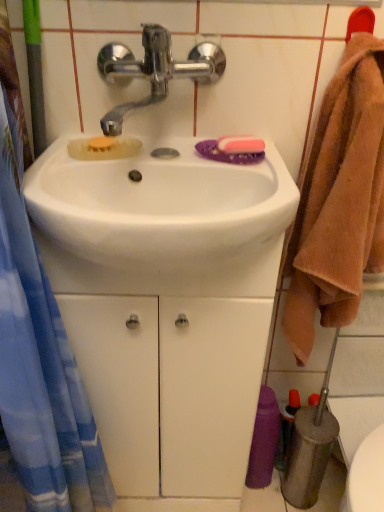
Question: Considering the relative positions of shiny metallic faucet at upper center and purple fabric towel at lower right in the image provided, is shiny metallic faucet at upper center to the left of purple fabric towel at lower right from the viewer's perspective?

Choices:
 (A) no
 (B) yes

Answer: (B)

Question: Considering the relative positions of shiny metallic faucet at upper center and purple fabric towel at lower right in the image provided, is shiny metallic faucet at upper center to the right of purple fabric towel at lower right from the viewer's perspective?

Choices:
 (A) yes
 (B) no

Answer: (B)

Question: From the image's perspective, is shiny metallic faucet at upper center located beneath purple fabric towel at lower right?

Choices:
 (A) yes
 (B) no

Answer: (B)

Question: Is shiny metallic faucet at upper center touching purple fabric towel at lower right?

Choices:
 (A) yes
 (B) no

Answer: (B)

Question: Would you say shiny metallic faucet at upper center contains purple fabric towel at lower right?

Choices:
 (A) no
 (B) yes

Answer: (A)

Question: Is shiny metallic faucet at upper center located outside purple fabric towel at lower right?

Choices:
 (A) no
 (B) yes

Answer: (B)

Question: Is white glossy sink at center thinner than brown fluffy towel at right?

Choices:
 (A) yes
 (B) no

Answer: (B)

Question: Does white glossy sink at center turn towards brown fluffy towel at right?

Choices:
 (A) yes
 (B) no

Answer: (B)

Question: Is white glossy sink at center far from brown fluffy towel at right?

Choices:
 (A) no
 (B) yes

Answer: (A)

Question: Is white glossy sink at center to the left of brown fluffy towel at right from the viewer's perspective?

Choices:
 (A) no
 (B) yes

Answer: (B)

Question: Considering the relative positions of white glossy sink at center and brown fluffy towel at right in the image provided, is white glossy sink at center to the right of brown fluffy towel at right from the viewer's perspective?

Choices:
 (A) no
 (B) yes

Answer: (A)

Question: Is white glossy sink at center turned away from brown fluffy towel at right?

Choices:
 (A) no
 (B) yes

Answer: (A)

Question: Can you see purple fabric towel at lower right touching white glossy sink at center?

Choices:
 (A) no
 (B) yes

Answer: (A)